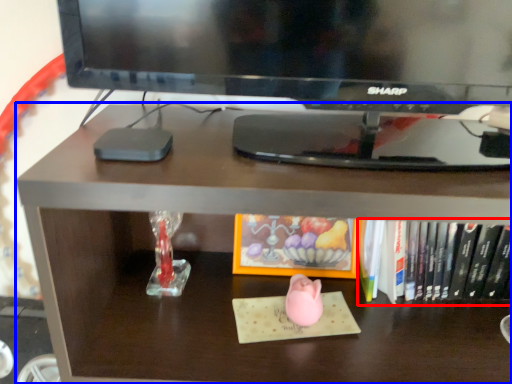
Question: Which of the following is the closest to the observer, book (highlighted by a red box) or desk (highlighted by a blue box)?

Choices:
 (A) book
 (B) desk

Answer: (B)